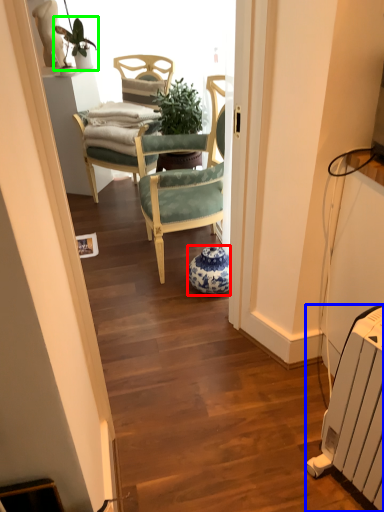
Question: Estimate the real-world distances between objects in this image. Which object is closer to vase (highlighted by a red box), radiator (highlighted by a blue box) or houseplant (highlighted by a green box)?

Choices:
 (A) radiator
 (B) houseplant

Answer: (A)